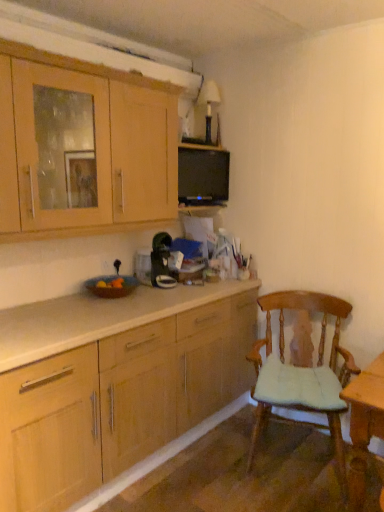
Question: Is wooden chair with cushion at right in front of or behind wooden cabinet at upper left in the image?

Choices:
 (A) front
 (B) behind

Answer: (B)

Question: Is wooden chair with cushion at right situated inside wooden cabinet at upper left or outside?

Choices:
 (A) outside
 (B) inside

Answer: (A)

Question: Considering the positions of point [342, 373] and point [105, 140], is point [342, 373] closer or farther from the camera than point [105, 140]?

Choices:
 (A) farther
 (B) closer

Answer: (A)

Question: Looking at their shapes, would you say wooden cabinet at upper left is wider or thinner than wooden chair with cushion at right?

Choices:
 (A) thin
 (B) wide

Answer: (A)

Question: From a real-world perspective, relative to wooden chair with cushion at right, is wooden cabinet at upper left vertically above or below?

Choices:
 (A) below
 (B) above

Answer: (B)

Question: Is point (109, 184) closer or farther from the camera than point (291, 397)?

Choices:
 (A) farther
 (B) closer

Answer: (A)

Question: Is wooden cabinet at upper left spatially inside wooden chair with cushion at right, or outside of it?

Choices:
 (A) inside
 (B) outside

Answer: (B)